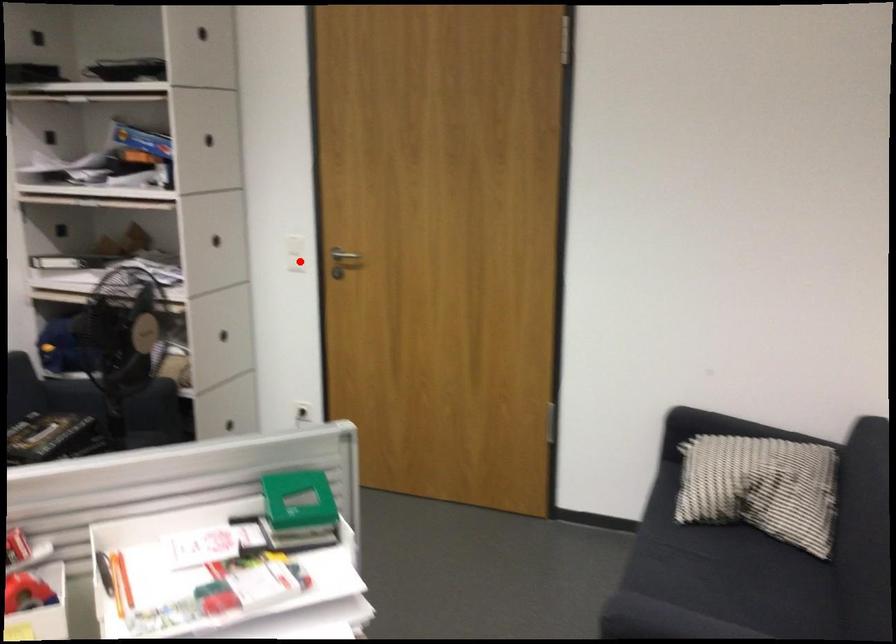
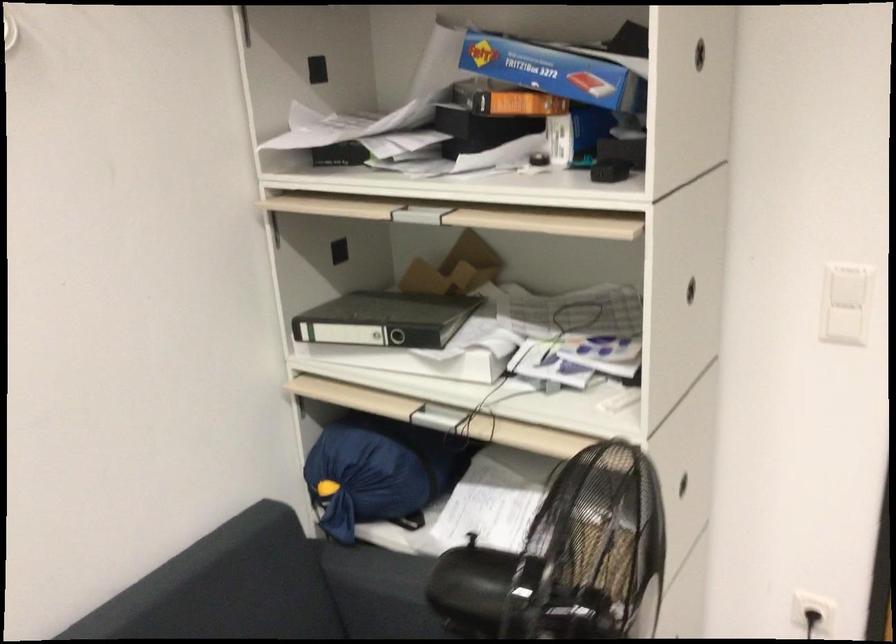
Locate, in the second image, the point that corresponds to the highlighted location in the first image.

(843, 326)